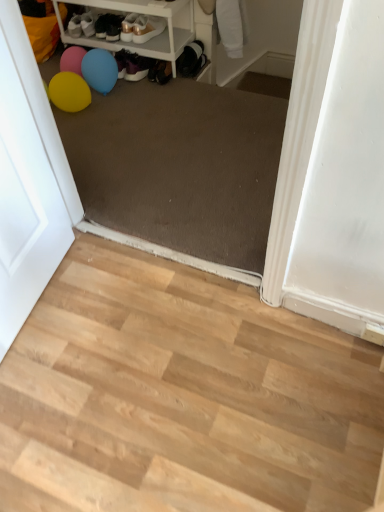
The width and height of the screenshot is (384, 512). What are the coordinates of `free point in front of white plastic shelf at upper left` in the screenshot? It's located at (152, 102).